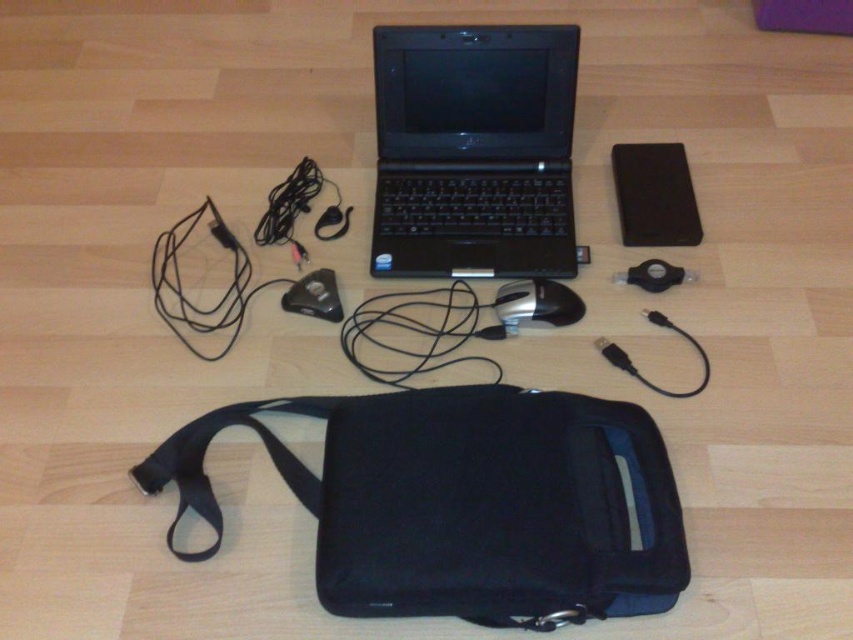
Which of these two, black fabric pouch at lower center or black plastic laptop at center, stands shorter?

black fabric pouch at lower center is shorter.

Which is below, black fabric pouch at lower center or black plastic laptop at center?

black fabric pouch at lower center

Is point (596, 461) positioned behind point (538, 204)?

No, (596, 461) is in front of (538, 204).

Identify the location of black fabric pouch at lower center. (463, 502).

Can you confirm if black fabric strap at lower center is taller than black matte mouse at center?

Yes, black fabric strap at lower center is taller than black matte mouse at center.

The height and width of the screenshot is (640, 853). What do you see at coordinates (202, 458) in the screenshot?
I see `black fabric strap at lower center` at bounding box center [202, 458].

This screenshot has height=640, width=853. I want to click on black fabric strap at lower center, so click(202, 458).

Which of these two, black plastic laptop at center or black rubberized ipod at upper right, stands shorter?

black rubberized ipod at upper right

Is point (451, 220) farther from camera compared to point (662, 202)?

No.

I want to click on black plastic laptop at center, so click(473, 150).